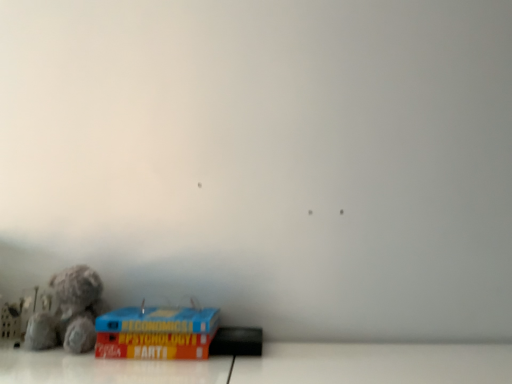
Where is `fuzzy fabric teddy bear at lower left`? fuzzy fabric teddy bear at lower left is located at coordinates (69, 312).

Describe the element at coordinates (69, 312) in the screenshot. The width and height of the screenshot is (512, 384). I see `fuzzy fabric teddy bear at lower left` at that location.

Find the location of a particular element. The image size is (512, 384). blue cardboard box at lower left is located at coordinates (156, 333).

What do you see at coordinates (156, 333) in the screenshot?
I see `blue cardboard box at lower left` at bounding box center [156, 333].

At what (x,y) coordinates should I click in order to perform the action: click on fuzzy fabric teddy bear at lower left. Please return your answer as a coordinate pair (x, y). The height and width of the screenshot is (384, 512). Looking at the image, I should click on (69, 312).

Is blue cardboard box at lower left at the right side of fuzzy fabric teddy bear at lower left?

Correct, you'll find blue cardboard box at lower left to the right of fuzzy fabric teddy bear at lower left.

Looking at this image, is blue cardboard box at lower left in front of or behind fuzzy fabric teddy bear at lower left in the image?

Visually, blue cardboard box at lower left is located in front of fuzzy fabric teddy bear at lower left.

Does point (140, 350) come behind point (66, 287)?

No.

From the image's perspective, is blue cardboard box at lower left located above fuzzy fabric teddy bear at lower left?

Incorrect, from the image's perspective, blue cardboard box at lower left is lower than fuzzy fabric teddy bear at lower left.

From a real-world perspective, is blue cardboard box at lower left physically below fuzzy fabric teddy bear at lower left?

Yes, from a real-world perspective, blue cardboard box at lower left is below fuzzy fabric teddy bear at lower left.

Considering the relative sizes of blue cardboard box at lower left and fuzzy fabric teddy bear at lower left in the image provided, is blue cardboard box at lower left wider than fuzzy fabric teddy bear at lower left?

Indeed, blue cardboard box at lower left has a greater width compared to fuzzy fabric teddy bear at lower left.

From their relative heights in the image, would you say blue cardboard box at lower left is taller or shorter than fuzzy fabric teddy bear at lower left?

blue cardboard box at lower left is shorter than fuzzy fabric teddy bear at lower left.

Which of these two, blue cardboard box at lower left or fuzzy fabric teddy bear at lower left, is smaller?

fuzzy fabric teddy bear at lower left.

Could fuzzy fabric teddy bear at lower left be considered to be inside blue cardboard box at lower left?

No, fuzzy fabric teddy bear at lower left is located outside of blue cardboard box at lower left.

Is blue cardboard box at lower left with fuzzy fabric teddy bear at lower left?

They are not placed beside each other.

Is fuzzy fabric teddy bear at lower left at the back of blue cardboard box at lower left?

A: No, blue cardboard box at lower left is not facing the opposite direction of fuzzy fabric teddy bear at lower left.

How many degrees apart are the facing directions of blue cardboard box at lower left and fuzzy fabric teddy bear at lower left?

10.9 degrees.

How far apart are blue cardboard box at lower left and fuzzy fabric teddy bear at lower left?

A distance of 4.95 inches exists between blue cardboard box at lower left and fuzzy fabric teddy bear at lower left.

There is a blue cardboard box at lower left. Where is `toy above it (from a real-world perspective)`? toy above it (from a real-world perspective) is located at coordinates (69, 312).

Based on their positions, is fuzzy fabric teddy bear at lower left located to the left or right of blue cardboard box at lower left?

From the image, it's evident that fuzzy fabric teddy bear at lower left is to the left of blue cardboard box at lower left.

Is fuzzy fabric teddy bear at lower left positioned before blue cardboard box at lower left?

No, the depth of fuzzy fabric teddy bear at lower left is greater than that of blue cardboard box at lower left.

Is point (71, 284) farther from camera compared to point (128, 345)?

Yes, point (71, 284) is farther from viewer.

From the image's perspective, is fuzzy fabric teddy bear at lower left under blue cardboard box at lower left?

No, from the image's perspective, fuzzy fabric teddy bear at lower left is not beneath blue cardboard box at lower left.

From a real-world perspective, between fuzzy fabric teddy bear at lower left and blue cardboard box at lower left, who is vertically higher?

fuzzy fabric teddy bear at lower left, from a real-world perspective.

Which of these two, fuzzy fabric teddy bear at lower left or blue cardboard box at lower left, is wider?

With larger width is blue cardboard box at lower left.

Is fuzzy fabric teddy bear at lower left taller or shorter than blue cardboard box at lower left?

Considering their sizes, fuzzy fabric teddy bear at lower left has more height than blue cardboard box at lower left.

Does fuzzy fabric teddy bear at lower left have a larger size compared to blue cardboard box at lower left?

Incorrect, fuzzy fabric teddy bear at lower left is not larger than blue cardboard box at lower left.

Can blue cardboard box at lower left be found inside fuzzy fabric teddy bear at lower left?

Actually, blue cardboard box at lower left is outside fuzzy fabric teddy bear at lower left.

Is fuzzy fabric teddy bear at lower left far away from blue cardboard box at lower left?

No.

Is fuzzy fabric teddy bear at lower left facing towards blue cardboard box at lower left?

No, fuzzy fabric teddy bear at lower left is not turned towards blue cardboard box at lower left.

How many degrees apart are the facing directions of fuzzy fabric teddy bear at lower left and blue cardboard box at lower left?

There is a 10.9-degree angle between the facing directions of fuzzy fabric teddy bear at lower left and blue cardboard box at lower left.

How distant is fuzzy fabric teddy bear at lower left from blue cardboard box at lower left?

fuzzy fabric teddy bear at lower left and blue cardboard box at lower left are 4.95 inches apart.

Image resolution: width=512 pixels, height=384 pixels. Find the location of `toy that appears above the blue cardboard box at lower left (from the image's perspective)`. toy that appears above the blue cardboard box at lower left (from the image's perspective) is located at coordinates coord(69,312).

Identify the location of toy on the left of blue cardboard box at lower left. (69, 312).

Identify the location of toy that appears above the blue cardboard box at lower left (from a real-world perspective). The image size is (512, 384). (69, 312).